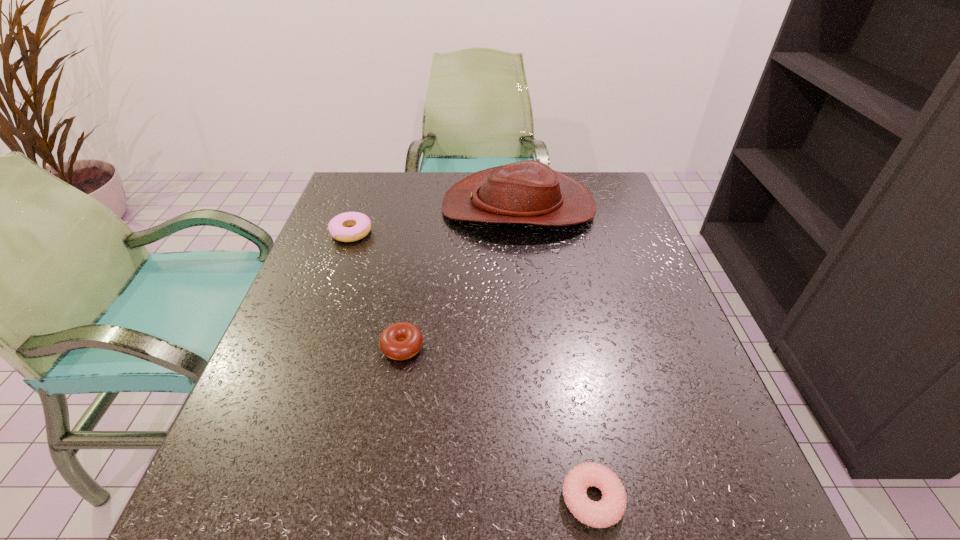
You are a GUI agent. You are given a task and a screenshot of the screen. Output one action in this format:
    pyautogui.click(x=<x>, y=<y>)
    Task: Click on the vacant space located on the front of the leftmost object
    The width and height of the screenshot is (960, 540).
    Given the screenshot: What is the action you would take?
    point(329,294)

You are a GUI agent. You are given a task and a screenshot of the screen. Output one action in this format:
    pyautogui.click(x=<x>, y=<y>)
    Task: Click on the free space located 0.070m on the left of the third object from right to left
    The width and height of the screenshot is (960, 540).
    Given the screenshot: What is the action you would take?
    pyautogui.click(x=344, y=347)

What are the coordinates of `blank space located 0.270m on the left of the rightmost doughnut` in the screenshot? It's located at (374, 499).

This screenshot has width=960, height=540. Find the location of `object situated at the far edge`. object situated at the far edge is located at coordinates (528, 192).

The width and height of the screenshot is (960, 540). Identify the location of object at the near edge. click(609, 510).

Locate an element on the screen. Image resolution: width=960 pixels, height=540 pixels. object that is at the left edge is located at coordinates (339, 227).

Locate an element on the screen. This screenshot has height=540, width=960. object present at the right edge is located at coordinates (528, 192).

The image size is (960, 540). I want to click on object present at the far right corner, so click(528, 192).

At what (x,y) coordinates should I click in order to perform the action: click on free space at the far edge. Please return your answer as a coordinate pair (x, y). Looking at the image, I should click on click(x=448, y=183).

In the image, there is a desktop. At what (x,y) coordinates should I click in order to perform the action: click on vacant space at the near edge. Please return your answer as a coordinate pair (x, y). Image resolution: width=960 pixels, height=540 pixels. Looking at the image, I should click on (456, 485).